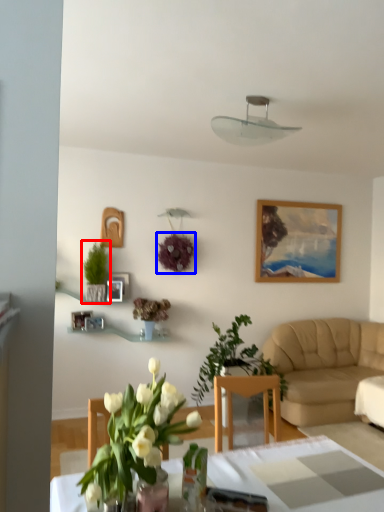
Question: Among these objects, which one is farthest to the camera, houseplant (highlighted by a red box) or flower (highlighted by a blue box)?

Choices:
 (A) houseplant
 (B) flower

Answer: (B)